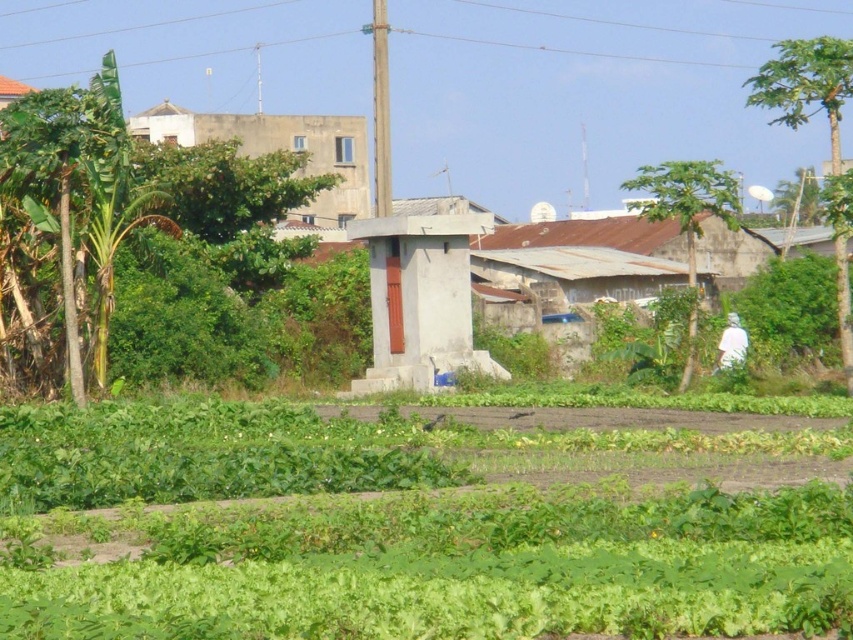
You are a farmer standing in the field and see the green leafy at center and the concrete building at upper center. Which object is located to the right of the other?

The green leafy at center is positioned on the right side of concrete building at upper center.